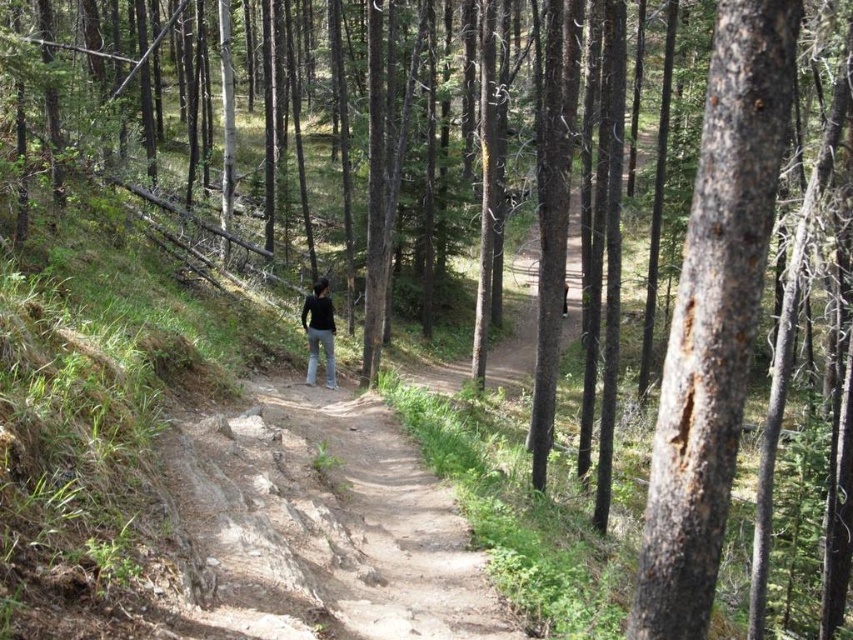
Question: Can you confirm if brown rough bark tree at center right is thinner than dark gray jeans at center?

Choices:
 (A) yes
 (B) no

Answer: (A)

Question: Can you confirm if brown rough bark tree at center right is thinner than dark gray jeans at center?

Choices:
 (A) yes
 (B) no

Answer: (A)

Question: Among these points, which one is farthest from the camera?

Choices:
 (A) (312, 330)
 (B) (730, 252)

Answer: (A)

Question: Can you confirm if brown rough bark tree at center right is wider than dark gray jeans at center?

Choices:
 (A) no
 (B) yes

Answer: (A)